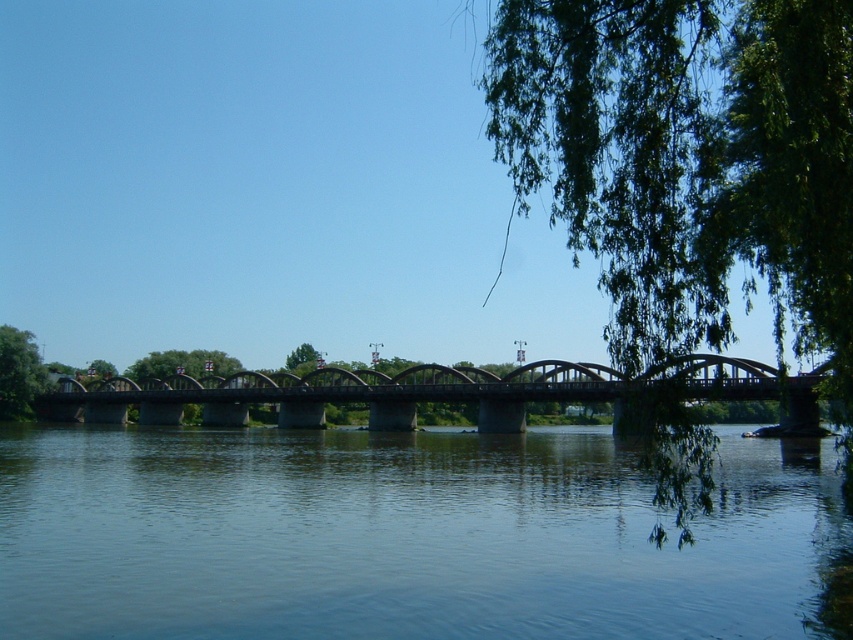
Can you confirm if clear blue water at center is positioned above green leafy tree at center?

Actually, clear blue water at center is below green leafy tree at center.

Is point (132, 428) farther from camera compared to point (163, 365)?

No, (132, 428) is in front of (163, 365).

Locate an element on the screen. Image resolution: width=853 pixels, height=640 pixels. clear blue water at center is located at coordinates click(397, 536).

Who is more distant from viewer, (x=572, y=618) or (x=9, y=337)?

Positioned behind is point (x=9, y=337).

Does clear blue water at center have a smaller size compared to green leafy tree at left?

Incorrect, clear blue water at center is not smaller in size than green leafy tree at left.

Is point (20, 508) more distant than point (3, 369)?

No, (20, 508) is closer to viewer.

What are the coordinates of `clear blue water at center` in the screenshot? It's located at (397, 536).

Is concrete bridge at center thinner than green leafy tree at left?

Incorrect, concrete bridge at center's width is not less than green leafy tree at left's.

Is point (386, 401) positioned in front of point (3, 385)?

That is True.

Where is `concrete bridge at center`? Image resolution: width=853 pixels, height=640 pixels. concrete bridge at center is located at coordinates (438, 392).